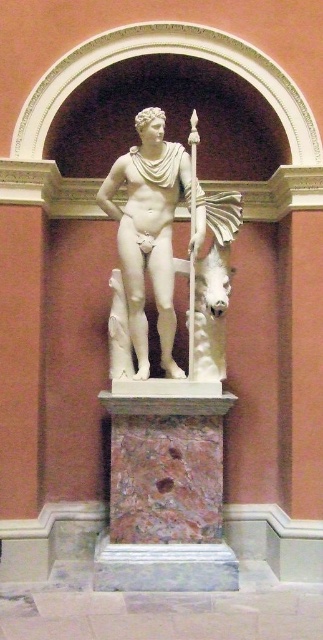
Question: Is marble pedestal at center bigger than white marble statue at center?

Choices:
 (A) no
 (B) yes

Answer: (A)

Question: Can you confirm if marble pedestal at center is positioned to the left of white marble statue at center?

Choices:
 (A) no
 (B) yes

Answer: (A)

Question: Among these objects, which one is farthest from the camera?

Choices:
 (A) white marble statue at center
 (B) marble pedestal at center

Answer: (A)

Question: Is marble pedestal at center positioned at the back of white marble statue at center?

Choices:
 (A) no
 (B) yes

Answer: (A)